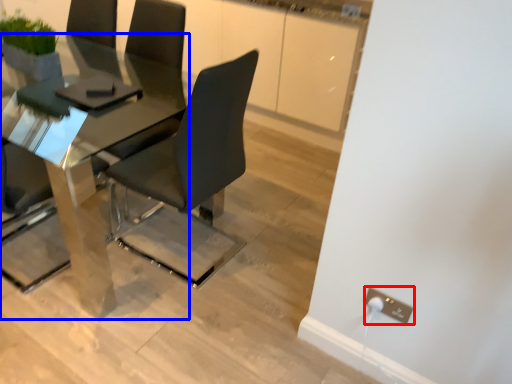
Question: Which point is closer to the camera, electric outlet (highlighted by a red box) or table (highlighted by a blue box)?

Choices:
 (A) electric outlet
 (B) table

Answer: (B)